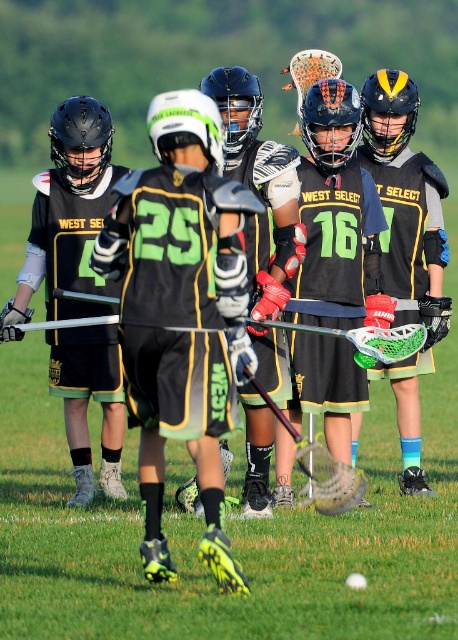
You are a coach observing the players during practice. You notice the black matte lacrosse stick at center and the matte black helmet at center. Which object is positioned higher in the image?

The black matte lacrosse stick at center is above the matte black helmet at center, so the lacrosse stick is positioned higher.

You are a coach observing the lacrosse practice. You notice the black matte lacrosse stick at center and the matte black helmet at center. Which object is wider? Please answer based on the scene description.

The black matte lacrosse stick at center is wider than the matte black helmet at center according to the description.

You are a photographer trying to capture a clear shot of the black matte lacrosse stick at center and the matte black helmet at center. Which object will appear larger in your photo?

The black matte lacrosse stick at center will appear larger in the photo because it is closer to the viewer than the matte black helmet at center.